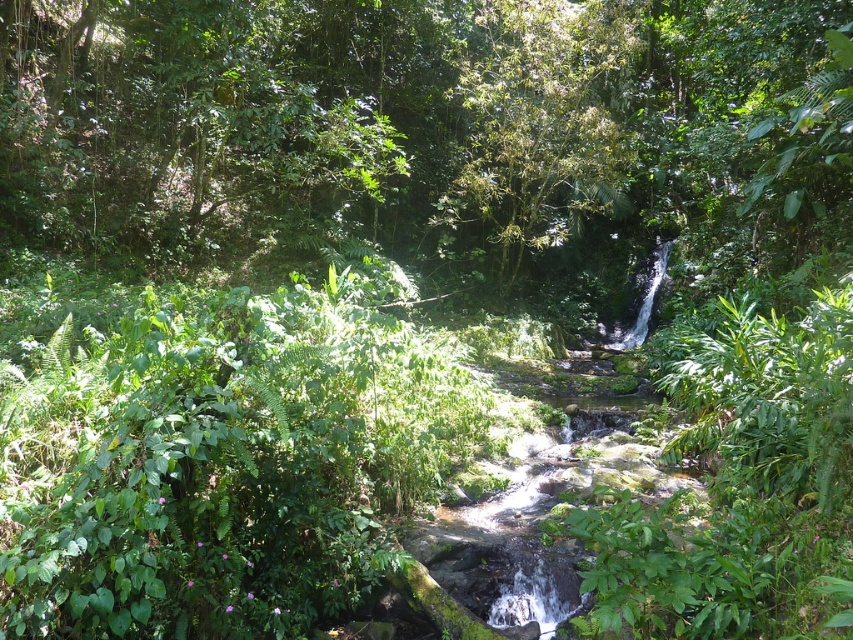
Question: Is green leafy tree at center smaller than green leafy tree at upper center?

Choices:
 (A) no
 (B) yes

Answer: (A)

Question: Which of the following is the farthest from the observer?

Choices:
 (A) green leafy tree at upper center
 (B) green leafy tree at center

Answer: (A)

Question: Is green leafy tree at center below green leafy tree at upper center?

Choices:
 (A) yes
 (B) no

Answer: (A)

Question: Which object appears farthest from the camera in this image?

Choices:
 (A) green leafy tree at center
 (B) green leafy tree at upper center

Answer: (B)

Question: Observing the image, what is the correct spatial positioning of green leafy tree at center in reference to green leafy tree at upper center?

Choices:
 (A) left
 (B) right

Answer: (A)